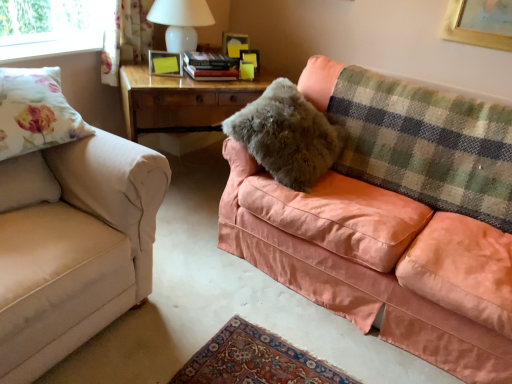
Question: Is white glossy table lamp at upper center a part of floral fabric curtain at upper left?

Choices:
 (A) yes
 (B) no

Answer: (B)

Question: Is floral fabric curtain at upper left to the right of white glossy table lamp at upper center from the viewer's perspective?

Choices:
 (A) yes
 (B) no

Answer: (B)

Question: Considering the relative positions of floral fabric curtain at upper left and white glossy table lamp at upper center in the image provided, is floral fabric curtain at upper left to the left of white glossy table lamp at upper center from the viewer's perspective?

Choices:
 (A) no
 (B) yes

Answer: (B)

Question: Does floral fabric curtain at upper left lie in front of white glossy table lamp at upper center?

Choices:
 (A) yes
 (B) no

Answer: (B)

Question: From the image's perspective, is floral fabric curtain at upper left over white glossy table lamp at upper center?

Choices:
 (A) no
 (B) yes

Answer: (A)

Question: Does floral fabric curtain at upper left lie behind white glossy table lamp at upper center?

Choices:
 (A) no
 (B) yes

Answer: (B)

Question: Is green plaid blanket at upper right far from white glossy table lamp at upper center?

Choices:
 (A) yes
 (B) no

Answer: (A)

Question: Does green plaid blanket at upper right contain white glossy table lamp at upper center?

Choices:
 (A) no
 (B) yes

Answer: (A)

Question: From the image's perspective, is green plaid blanket at upper right below white glossy table lamp at upper center?

Choices:
 (A) yes
 (B) no

Answer: (A)

Question: Can you confirm if green plaid blanket at upper right is bigger than white glossy table lamp at upper center?

Choices:
 (A) yes
 (B) no

Answer: (A)

Question: Is green plaid blanket at upper right turned away from white glossy table lamp at upper center?

Choices:
 (A) yes
 (B) no

Answer: (B)

Question: Considering the relative positions of green plaid blanket at upper right and white glossy table lamp at upper center in the image provided, is green plaid blanket at upper right to the left of white glossy table lamp at upper center from the viewer's perspective?

Choices:
 (A) yes
 (B) no

Answer: (B)

Question: Could you tell me if wooden table at center is facing beige fabric couch at left, marked as the 2th studio couch in a right-to-left arrangement?

Choices:
 (A) yes
 (B) no

Answer: (B)